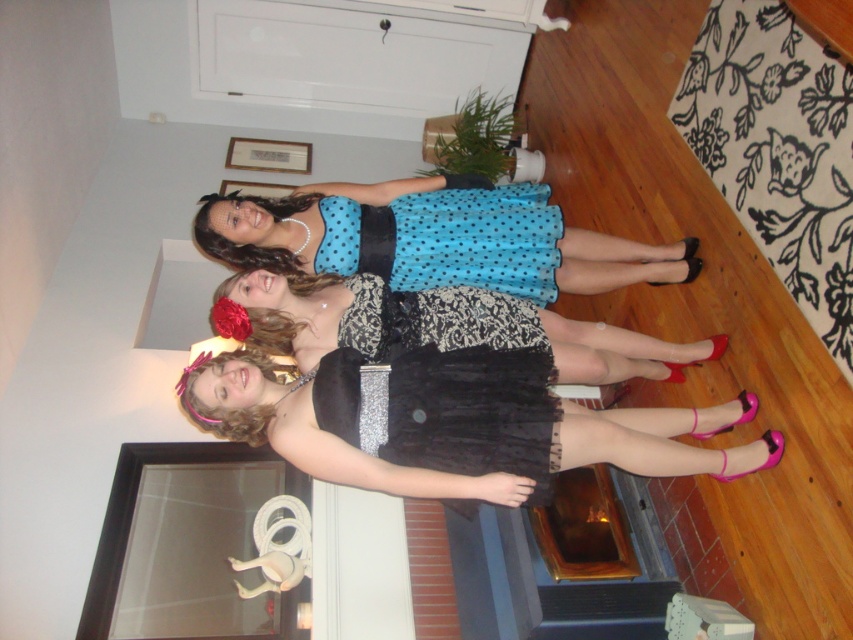
Question: Is black tulle dress at center above blue polka dot tulle dress at center?

Choices:
 (A) yes
 (B) no

Answer: (B)

Question: Which object appears closest to the camera in this image?

Choices:
 (A) blue polka dot tulle dress at center
 (B) black tulle dress at center

Answer: (B)

Question: Which object is the closest to the black lace dress at center?

Choices:
 (A) blue polka dot tulle dress at center
 (B) black tulle dress at center

Answer: (B)

Question: From the image, what is the correct spatial relationship of black tulle dress at center in relation to blue polka dot dress at center?

Choices:
 (A) below
 (B) above

Answer: (A)

Question: Which point is closer to the camera?

Choices:
 (A) 347,252
 (B) 490,243

Answer: (A)

Question: Is blue polka dot dress at center below blue polka dot tulle dress at center?

Choices:
 (A) no
 (B) yes

Answer: (B)